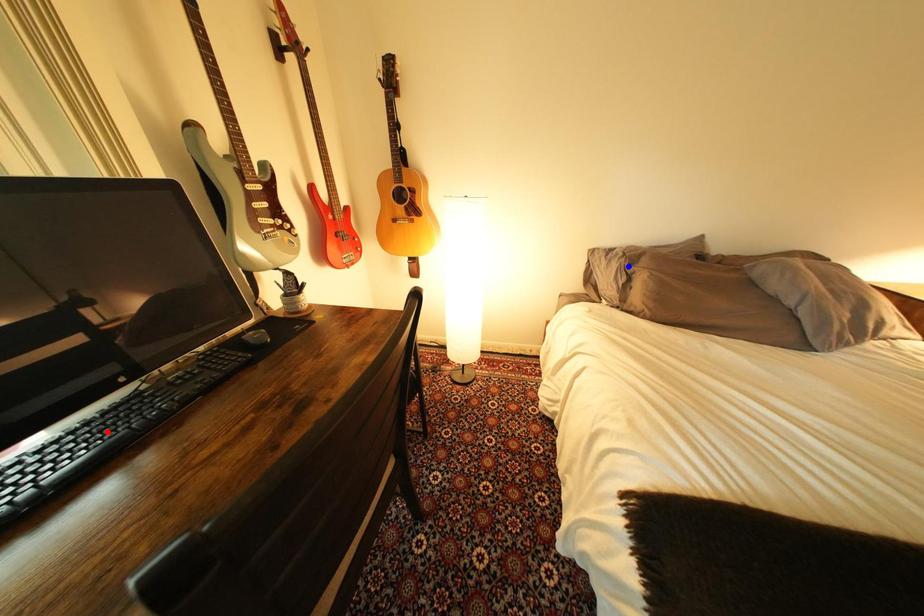
Question: Which of the two points in the image is closer to the camera?

Choices:
 (A) Blue point is closer.
 (B) Red point is closer.

Answer: (B)